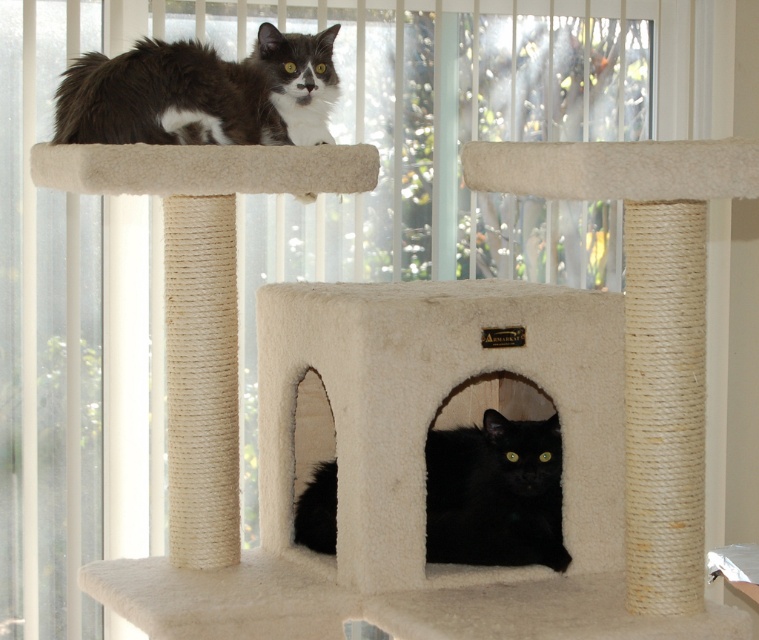
You are a cat owner who wants to place a toy between the gray and white fur cat at upper left and the black fuzzy cat at lower center. How far apart should you place the toy to ensure it is exactly halfway between them?

The gray and white fur cat at upper left and the black fuzzy cat at lower center are 20.20 inches apart. To place the toy exactly halfway between them, you should position it 10.10 inches from each cat.

You are a cat owner who wants to buy a new cat bed. You have two cats, a gray and white fur cat at upper left and a black fuzzy cat at lower center. Based on their sizes, which cat would need a larger bed?

The gray and white fur cat at upper left would need a larger bed since its width is larger than the black fuzzy cat at lower center.